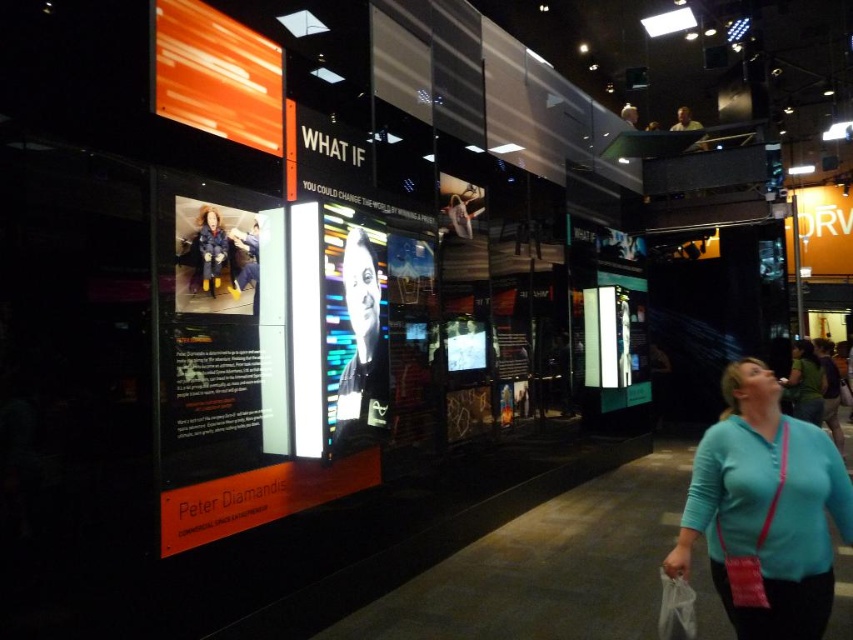
Is blue cotton shirt at lower right bigger than orange glossy screen at upper left?

Indeed, blue cotton shirt at lower right has a larger size compared to orange glossy screen at upper left.

Describe the element at coordinates (764, 509) in the screenshot. The image size is (853, 640). I see `blue cotton shirt at lower right` at that location.

The image size is (853, 640). Find the location of `blue cotton shirt at lower right`. blue cotton shirt at lower right is located at coordinates (764, 509).

Can you confirm if orange glossy screen at upper left is positioned above black glossy portrait at center?

Indeed, orange glossy screen at upper left is positioned over black glossy portrait at center.

Between orange glossy screen at upper left and black glossy portrait at center, which one has less height?

Standing shorter between the two is orange glossy screen at upper left.

Locate an element on the screen. The height and width of the screenshot is (640, 853). orange glossy screen at upper left is located at coordinates (216, 74).

What are the coordinates of `orange glossy screen at upper left` in the screenshot? It's located at (216, 74).

Who is more forward, (169, 92) or (241, 278)?

Point (169, 92)

Between orange glossy screen at upper left and blue denim jacket at center, which one has less height?

With less height is blue denim jacket at center.

Find the location of a particular element. The image size is (853, 640). orange glossy screen at upper left is located at coordinates (216, 74).